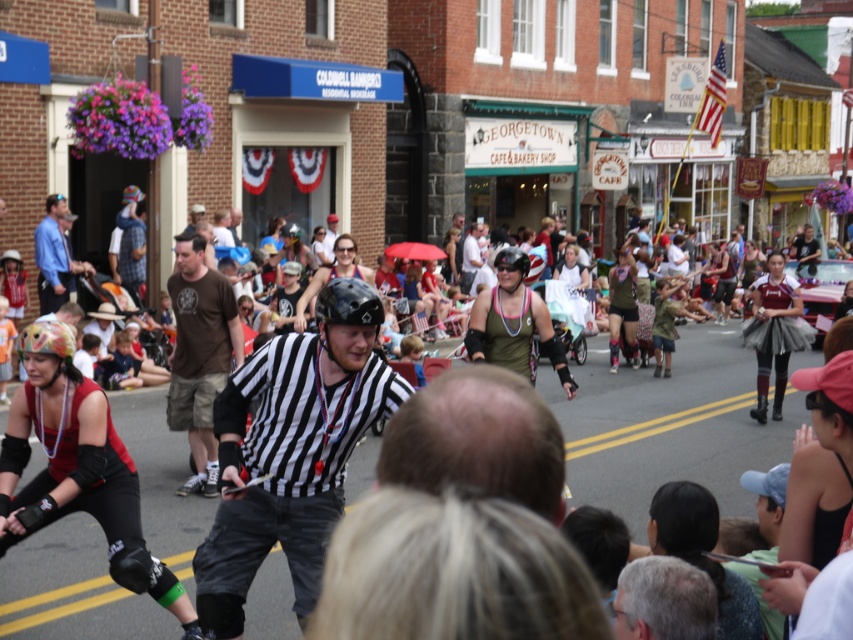
Who is more distant from viewer, (326,348) or (62,342)?

Point (62,342)

Is black striped shirt at center shorter than reddish-brown leather helmet at center-left?

Yes, black striped shirt at center is shorter than reddish-brown leather helmet at center-left.

Who is more forward, (x=296, y=364) or (x=57, y=451)?

Point (x=296, y=364) is in front.

The width and height of the screenshot is (853, 640). Find the location of `black striped shirt at center`. black striped shirt at center is located at coordinates (291, 451).

This screenshot has width=853, height=640. What do you see at coordinates (291, 451) in the screenshot? I see `black striped shirt at center` at bounding box center [291, 451].

Can you confirm if black striped shirt at center is positioned to the left of brown cotton t-shirt at center?

Incorrect, black striped shirt at center is not on the left side of brown cotton t-shirt at center.

Who is more distant from viewer, (x=323, y=436) or (x=187, y=340)?

Positioned behind is point (x=187, y=340).

Where is `black striped shirt at center`? The image size is (853, 640). black striped shirt at center is located at coordinates (291, 451).

Can you confirm if brown cotton t-shirt at center is thinner than blue shirt at left?

Correct, brown cotton t-shirt at center's width is less than blue shirt at left's.

Can you confirm if brown cotton t-shirt at center is smaller than blue shirt at left?

No.

Does point (212, 339) lie behind point (61, 276)?

No, it is not.

Identify the location of brown cotton t-shirt at center. Image resolution: width=853 pixels, height=640 pixels. (199, 355).